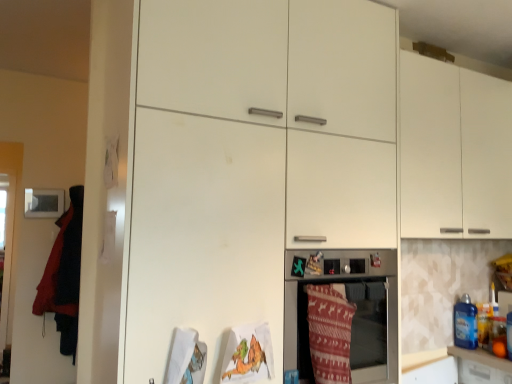
Question: Could you tell me if matte white oven at center is turned towards blue plastic bottle at right?

Choices:
 (A) yes
 (B) no

Answer: (B)

Question: Are matte white oven at center and blue plastic bottle at right beside each other?

Choices:
 (A) no
 (B) yes

Answer: (A)

Question: Would you consider matte white oven at center to be distant from blue plastic bottle at right?

Choices:
 (A) no
 (B) yes

Answer: (A)

Question: Considering the relative sizes of matte white oven at center and blue plastic bottle at right in the image provided, is matte white oven at center thinner than blue plastic bottle at right?

Choices:
 (A) no
 (B) yes

Answer: (A)

Question: Does matte white oven at center come in front of blue plastic bottle at right?

Choices:
 (A) yes
 (B) no

Answer: (A)

Question: Is matte white oven at center taller than blue plastic bottle at right?

Choices:
 (A) yes
 (B) no

Answer: (A)

Question: Is knitted woolen blanket at lower center, the 1th blanket viewed from the right, closer to camera compared to white matte cabinet at upper right?

Choices:
 (A) no
 (B) yes

Answer: (B)

Question: Is knitted woolen blanket at lower center, placed as the second blanket when sorted from back to front, positioned beyond the bounds of white matte cabinet at upper right?

Choices:
 (A) yes
 (B) no

Answer: (A)

Question: Is knitted woolen blanket at lower center, placed as the second blanket when sorted from left to right, behind white matte cabinet at upper right?

Choices:
 (A) no
 (B) yes

Answer: (A)

Question: Can you confirm if knitted woolen blanket at lower center, placed as the second blanket when sorted from back to front, is bigger than white matte cabinet at upper right?

Choices:
 (A) yes
 (B) no

Answer: (B)

Question: From a real-world perspective, is knitted woolen blanket at lower center, placed as the 1th blanket when sorted from front to back, beneath white matte cabinet at upper right?

Choices:
 (A) yes
 (B) no

Answer: (A)

Question: Does knitted woolen blanket at lower center, the 1th blanket viewed from the right, have a greater height compared to white matte cabinet at upper right?

Choices:
 (A) yes
 (B) no

Answer: (B)

Question: Is velvet red blanket at left, which ranks as the 1th blanket in back-to-front order, aimed at matte white oven at center?

Choices:
 (A) yes
 (B) no

Answer: (B)